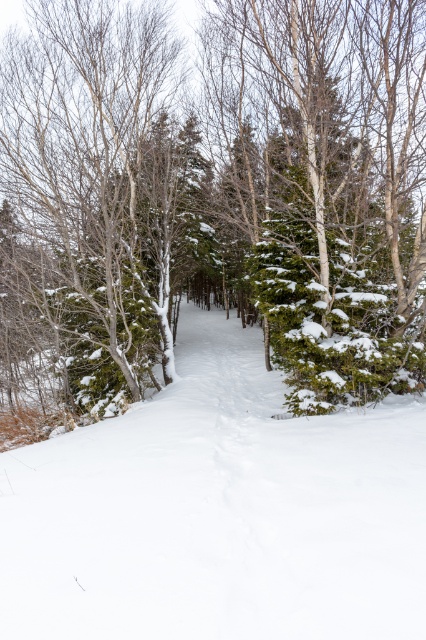
Question: Which point is closer to the camera taking this photo?

Choices:
 (A) (100, 3)
 (B) (40, 317)
 (C) (368, 506)

Answer: (C)

Question: Does snow-covered evergreen tree at center have a larger size compared to white snow ski slope at center?

Choices:
 (A) yes
 (B) no

Answer: (A)

Question: Which point is farther to the camera?

Choices:
 (A) (8, 246)
 (B) (109, 285)
 (C) (235, 432)

Answer: (A)

Question: Is snow-covered evergreen tree at center to the left of white snow ski slope at center from the viewer's perspective?

Choices:
 (A) no
 (B) yes

Answer: (B)

Question: Does snow-covered evergreen tree at center appear on the right side of snow-covered evergreen tree at left?

Choices:
 (A) yes
 (B) no

Answer: (A)

Question: Among these objects, which one is farthest from the camera?

Choices:
 (A) snow-covered evergreen tree at center
 (B) white snow ski slope at center

Answer: (A)